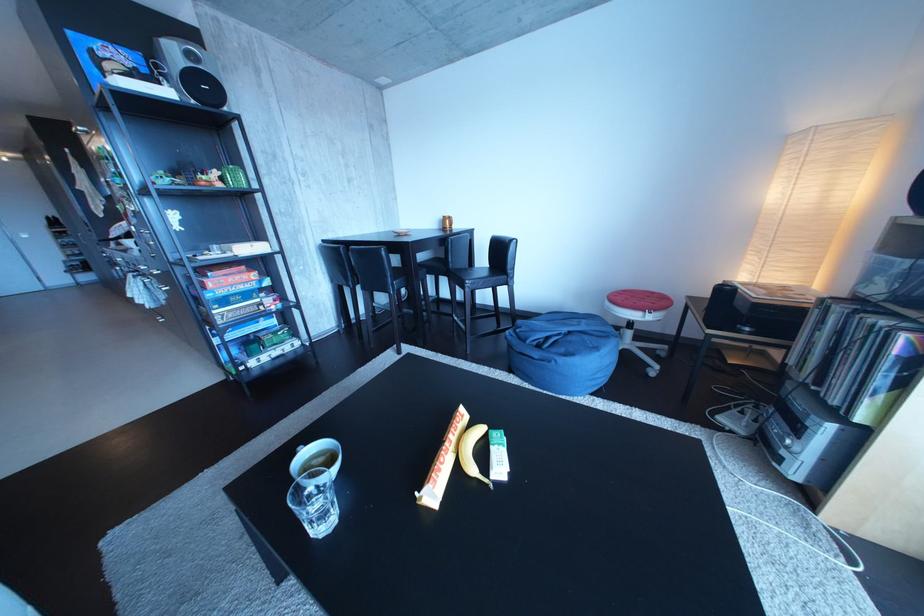
At what (x,y) coordinates should I click in order to perform the action: click on blue beanbag. Please return your answer as a coordinate pair (x, y). The width and height of the screenshot is (924, 616). Looking at the image, I should click on (563, 352).